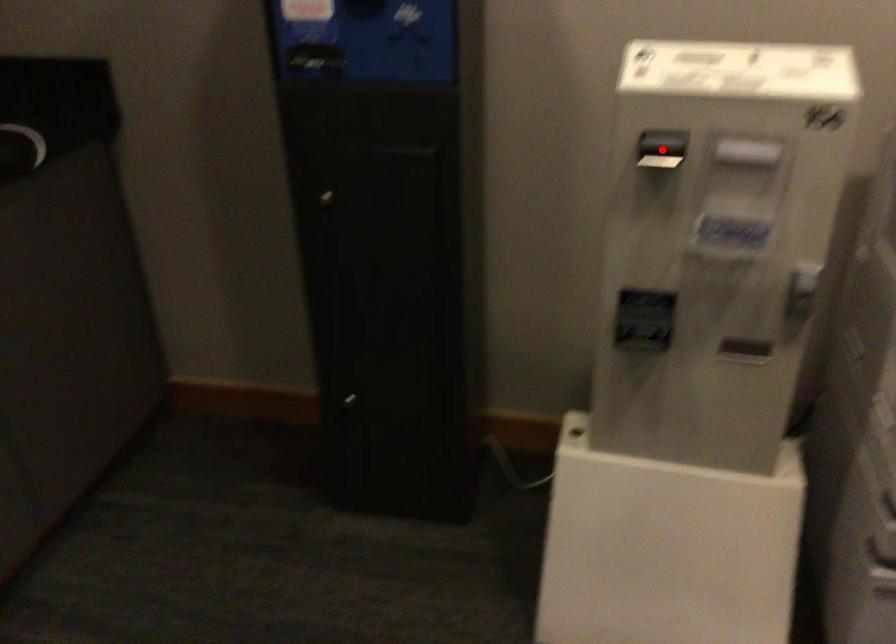
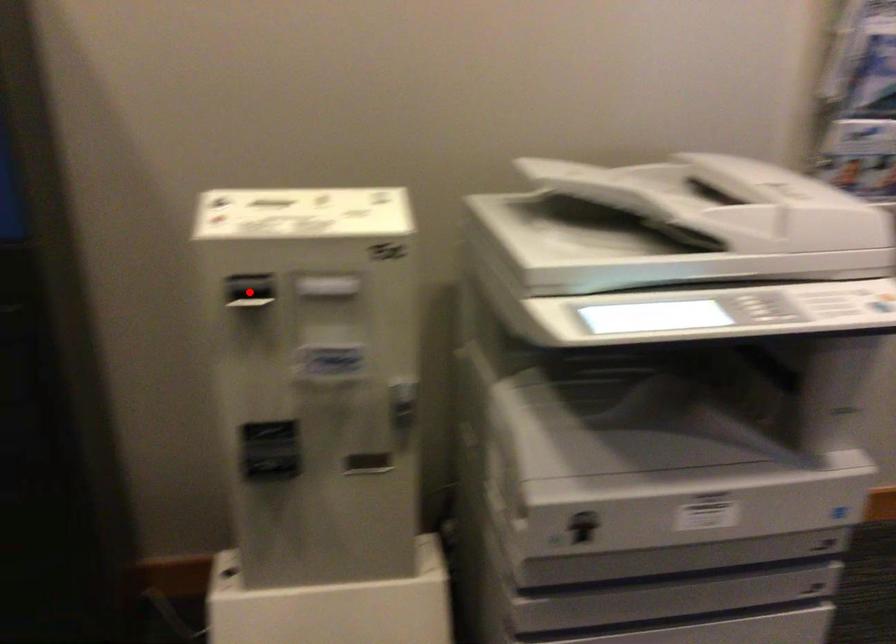
I am providing you with two images of the same scene from different viewpoints. A red point is marked on the first image and another point is marked on the second image. Does the point marked in image1 correspond to the same location as the one in image2?

Yes